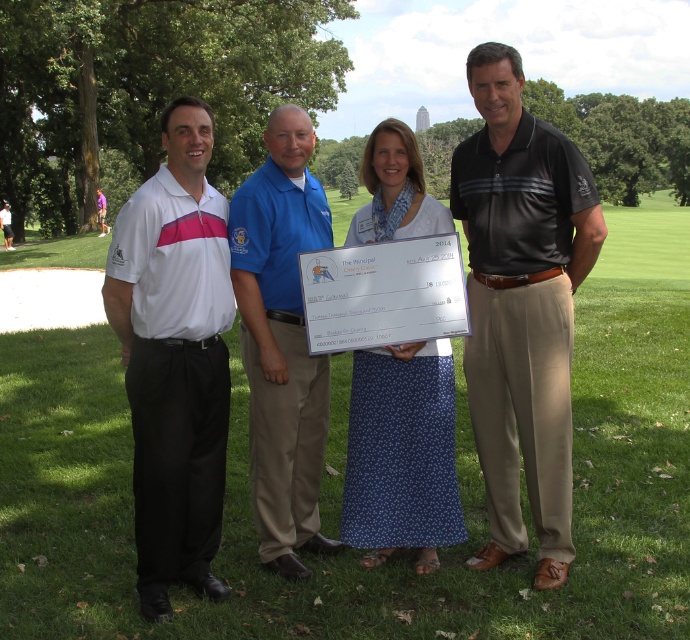
Looking at this image, you are a photographer standing 2 meters away from the camera. You want to take a photo of the white cotton shirt at upper left. Can you reach the camera in time to capture the shirt before the group moves?

The distance between you and the camera is 2 meters, and the camera and the white cotton shirt at upper left are 3.59 meters apart. Since you can reach the camera within that distance, you can position yourself to capture the white cotton shirt at upper left before the group moves.

You are a photographer trying to arrange the group for a better photo. The white cotton shirt at upper left and the white smooth polo shirt at left are currently overlapping. Which shirt should you move to the left to prevent overlapping?

The white smooth polo shirt at left should be moved to the left since the white cotton shirt at upper left is currently positioned to its right, causing the overlap. Moving the white smooth polo shirt at left further left would resolve the overlap.

You are a photographer trying to focus on the white cotton shirt at upper left. Where should you aim your camera to capture it?

The white cotton shirt at upper left is located at point (522, 307), so aim your camera at those coordinates to capture it.